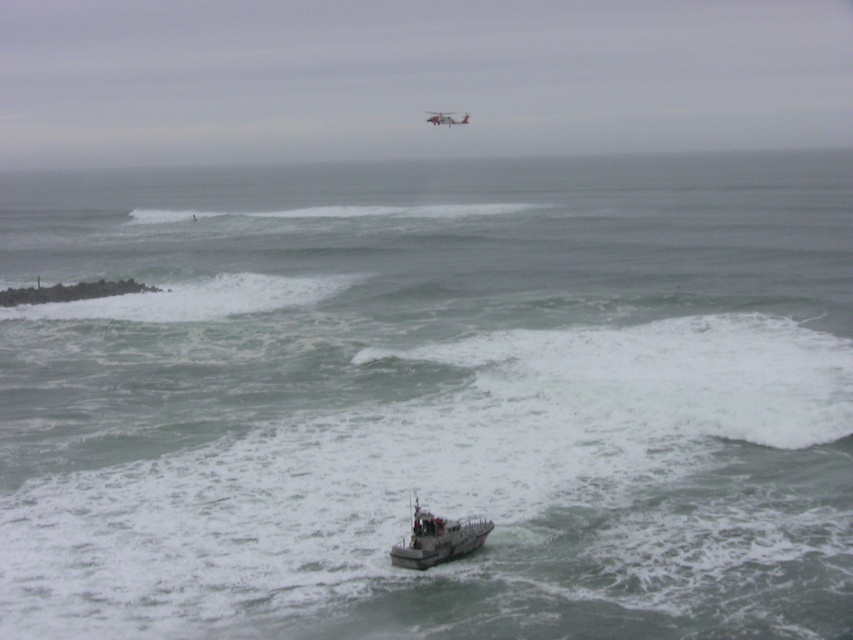
Question: Is gray metallic boat at center above metallic gray helicopter at upper center?

Choices:
 (A) no
 (B) yes

Answer: (A)

Question: Which object is farther from the camera taking this photo?

Choices:
 (A) metallic gray helicopter at upper center
 (B) gray metallic boat at center

Answer: (A)

Question: Among these points, which one is nearest to the camera?

Choices:
 (A) (434, 109)
 (B) (409, 548)

Answer: (B)

Question: Is the position of gray metallic boat at center less distant than that of metallic gray helicopter at upper center?

Choices:
 (A) no
 (B) yes

Answer: (B)

Question: Does gray metallic boat at center have a smaller size compared to metallic gray helicopter at upper center?

Choices:
 (A) yes
 (B) no

Answer: (A)

Question: Which point appears farthest from the camera in this image?

Choices:
 (A) (466, 116)
 (B) (445, 532)

Answer: (A)